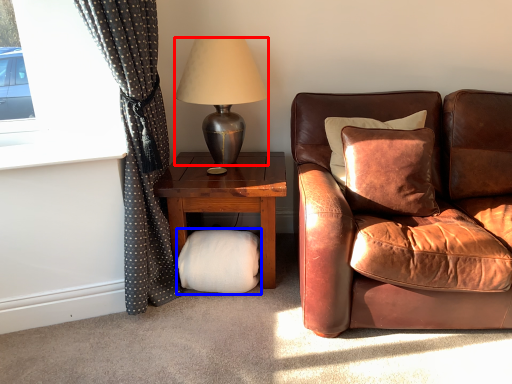
Question: Which of the following is the farthest to the observer, lamp (highlighted by a red box) or footrest (highlighted by a blue box)?

Choices:
 (A) lamp
 (B) footrest

Answer: (B)